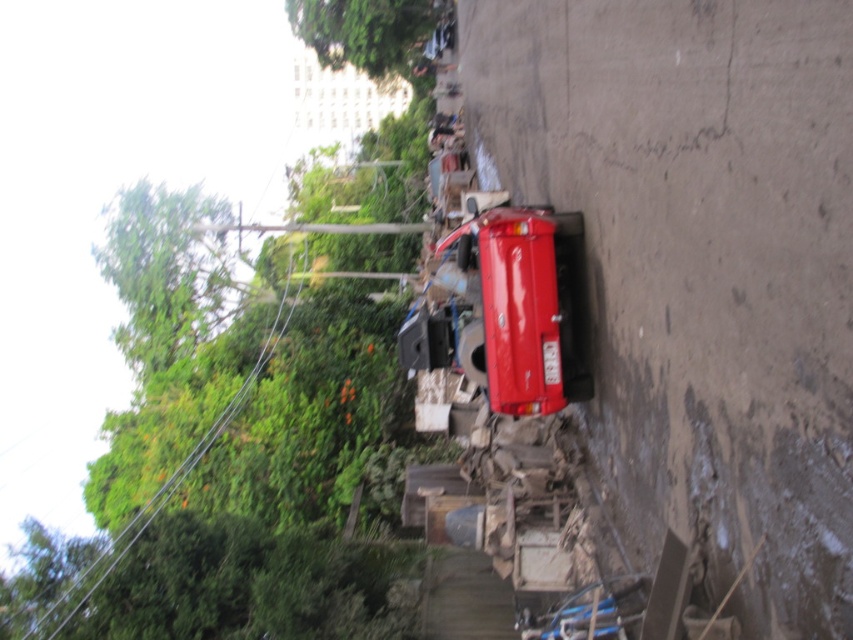
Question: Which point appears farthest from the camera in this image?

Choices:
 (A) (123, 536)
 (B) (567, 227)

Answer: (A)

Question: Can you confirm if glossy red fire truck at center is smaller than green leafy power line at upper left?

Choices:
 (A) no
 (B) yes

Answer: (B)

Question: Can you confirm if glossy red fire truck at center is positioned to the right of green leafy power line at upper left?

Choices:
 (A) yes
 (B) no

Answer: (A)

Question: Can you confirm if glossy red fire truck at center is bigger than green leafy power line at upper left?

Choices:
 (A) no
 (B) yes

Answer: (A)